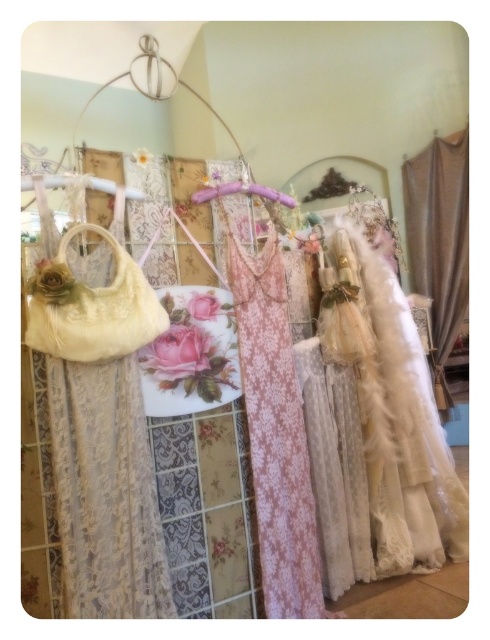
You are a customer in a boutique and want to examine both the white lace dress at center and the purple satin hanger at center. Which item will you encounter first as you approach the display?

You will encounter the white lace dress at center first because it is closer to you than the purple satin hanger at center, which is positioned further back in the display.